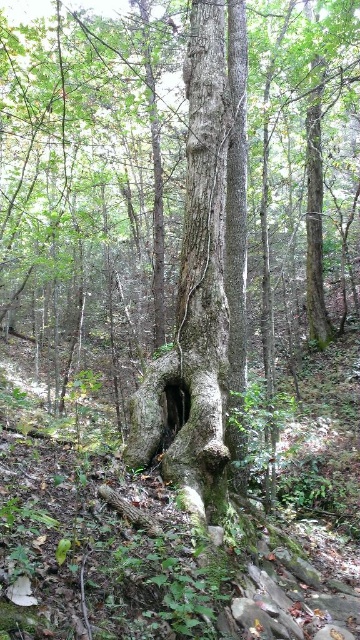
Is rough bark tree trunk at center positioned at the back of smooth dark wood hole at center?

No, it is not.

The image size is (360, 640). Find the location of `rough bark tree trunk at center`. rough bark tree trunk at center is located at coordinates (195, 291).

Does point (195, 45) come behind point (181, 417)?

Yes, point (195, 45) is behind point (181, 417).

This screenshot has height=640, width=360. What are the coordinates of `rough bark tree trunk at center` in the screenshot? It's located at (195, 291).